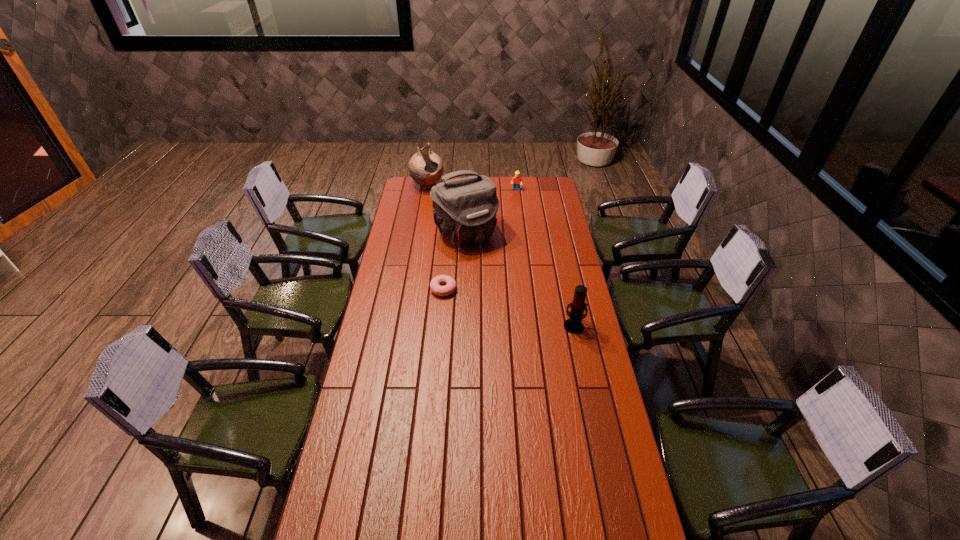
Where is `vacant space that satisfies the following two spatial constraints: 1. on the front side of the second nearest object; 2. on the right side of the nearest object`? This screenshot has width=960, height=540. vacant space that satisfies the following two spatial constraints: 1. on the front side of the second nearest object; 2. on the right side of the nearest object is located at coordinates (441, 326).

Identify the location of vacant space that satisfies the following two spatial constraints: 1. on the back side of the doughnut; 2. on the left side of the shoulder bag. Image resolution: width=960 pixels, height=540 pixels. coord(448,234).

Where is `blank area in the image that satisfies the following two spatial constraints: 1. on the back side of the second nearest object; 2. on the left side of the Lego`? This screenshot has width=960, height=540. blank area in the image that satisfies the following two spatial constraints: 1. on the back side of the second nearest object; 2. on the left side of the Lego is located at coordinates (x=452, y=190).

Locate an element on the screen. vacant space that satisfies the following two spatial constraints: 1. on the front side of the microphone; 2. on the right side of the shortest object is located at coordinates (441, 326).